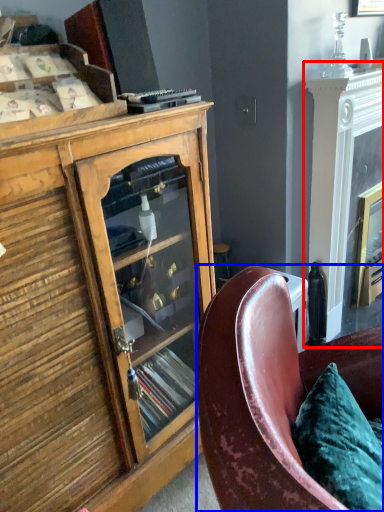
Question: Among these objects, which one is farthest to the camera, fireplace (highlighted by a red box) or chair (highlighted by a blue box)?

Choices:
 (A) fireplace
 (B) chair

Answer: (A)